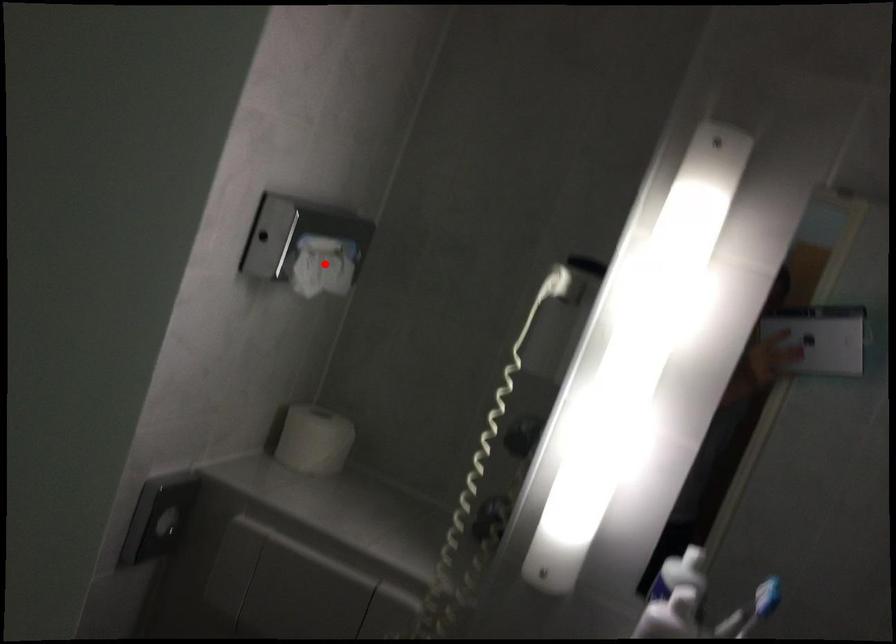
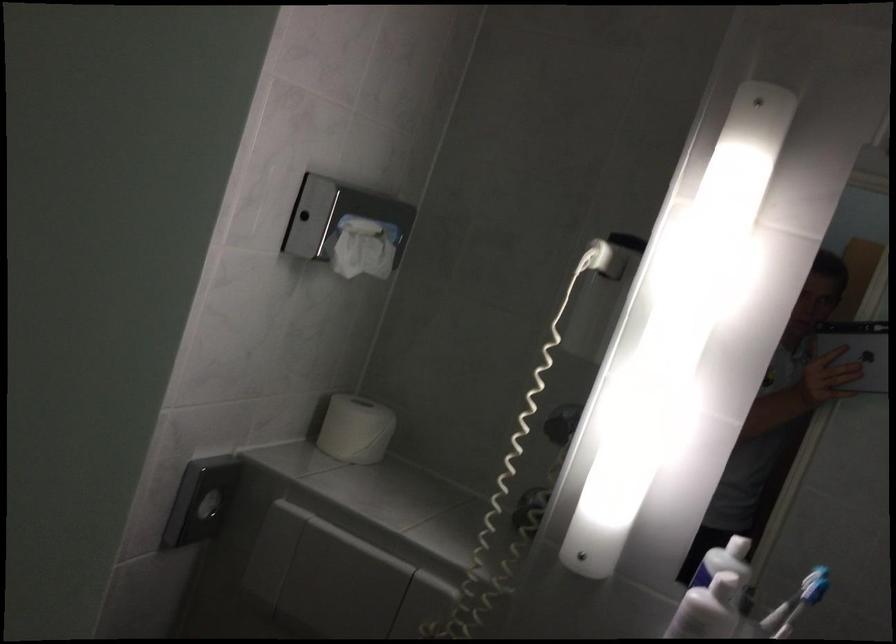
Locate, in the second image, the point that corresponds to the highlighted location in the first image.

(364, 247)